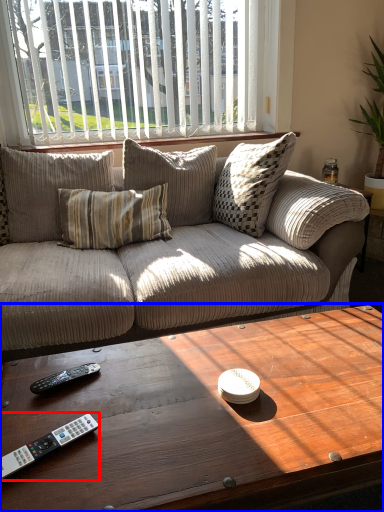
Question: Among these objects, which one is nearest to the camera, remote control (highlighted by a red box) or coffee table (highlighted by a blue box)?

Choices:
 (A) remote control
 (B) coffee table

Answer: (B)